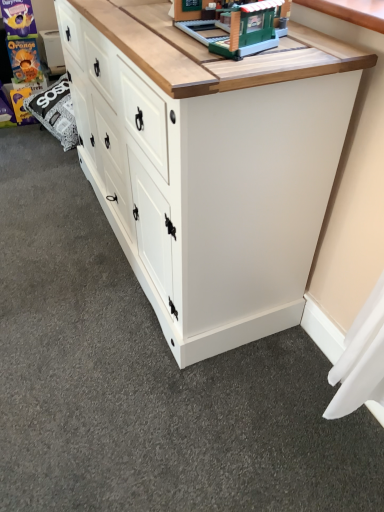
Question: Is green plastic building at upper center not close to white painted wood chest of drawers at center?

Choices:
 (A) yes
 (B) no

Answer: (B)

Question: Does green plastic building at upper center have a lesser width compared to white painted wood chest of drawers at center?

Choices:
 (A) yes
 (B) no

Answer: (A)

Question: Does green plastic building at upper center appear on the right side of white painted wood chest of drawers at center?

Choices:
 (A) yes
 (B) no

Answer: (A)

Question: Does green plastic building at upper center have a lesser height compared to white painted wood chest of drawers at center?

Choices:
 (A) yes
 (B) no

Answer: (A)

Question: Is green plastic building at upper center positioned in front of white painted wood chest of drawers at center?

Choices:
 (A) yes
 (B) no

Answer: (B)

Question: Can you confirm if green plastic building at upper center is smaller than white painted wood chest of drawers at center?

Choices:
 (A) no
 (B) yes

Answer: (B)

Question: Is the depth of white painted wood chest of drawers at center less than that of green plastic building at upper center?

Choices:
 (A) no
 (B) yes

Answer: (B)

Question: From the image's perspective, is white painted wood chest of drawers at center beneath green plastic building at upper center?

Choices:
 (A) yes
 (B) no

Answer: (A)

Question: Considering the relative sizes of white painted wood chest of drawers at center and green plastic building at upper center in the image provided, is white painted wood chest of drawers at center thinner than green plastic building at upper center?

Choices:
 (A) yes
 (B) no

Answer: (B)

Question: Is white painted wood chest of drawers at center behind green plastic building at upper center?

Choices:
 (A) no
 (B) yes

Answer: (A)

Question: Is white painted wood chest of drawers at center looking in the opposite direction of green plastic building at upper center?

Choices:
 (A) yes
 (B) no

Answer: (B)

Question: Does white painted wood chest of drawers at center have a larger size compared to green plastic building at upper center?

Choices:
 (A) yes
 (B) no

Answer: (A)

Question: From the image's perspective, is white painted wood chest of drawers at center located above or below green plastic building at upper center?

Choices:
 (A) above
 (B) below

Answer: (B)